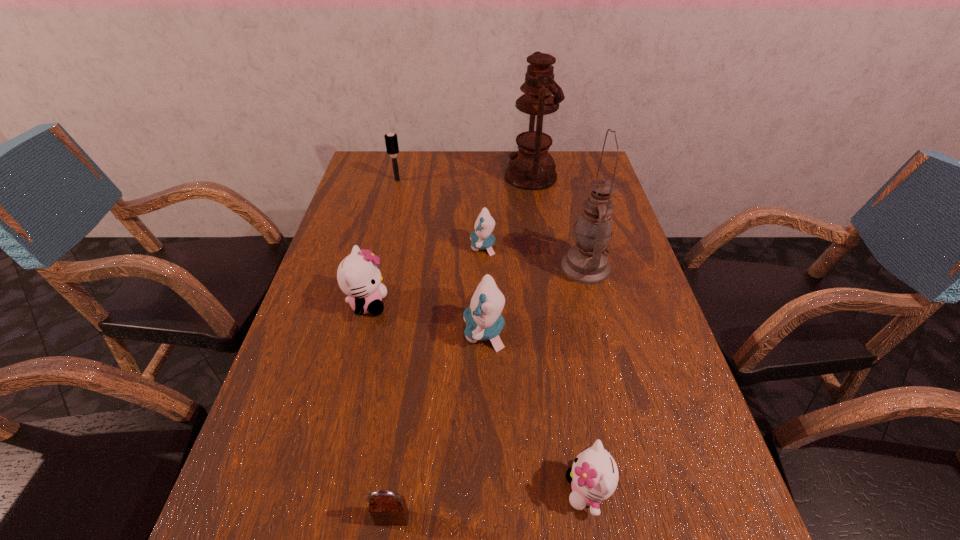
The height and width of the screenshot is (540, 960). Find the location of `blank region between the padlock and the farther oil lamp`. blank region between the padlock and the farther oil lamp is located at coordinates (462, 347).

This screenshot has width=960, height=540. Identify the location of free space between the farther oil lamp and the brown padlock. (462, 347).

Locate an element on the screen. This screenshot has width=960, height=540. vacant area between the hairbrush and the leftmost kitten is located at coordinates (382, 242).

You are a GUI agent. You are given a task and a screenshot of the screen. Output one action in this format:
    pyautogui.click(x=<x>, y=<y>)
    Task: Click on the free space between the rightmost kitten and the farther oil lamp
    This screenshot has width=960, height=540.
    Given the screenshot: What is the action you would take?
    559,333

This screenshot has width=960, height=540. I want to click on free area in between the sixth object from right to left and the gray oil lamp, so click(x=489, y=393).

Identify the location of the fourth closest object to the bigger blue kitten. (594, 475).

Identify which object is the sixth nearest to the gray oil lamp. Please provide its 2D coordinates. Your answer should be formatted as a tuple, i.e. [(x, y)], where the tuple contains the x and y coordinates of a point satisfying the conditions above.

[(391, 139)]

This screenshot has height=540, width=960. I want to click on the third closest kitten to the padlock, so click(x=358, y=275).

The image size is (960, 540). In order to click on the third closest kitten relative to the nearest kitten in this screenshot , I will do `click(481, 238)`.

You are a GUI agent. You are given a task and a screenshot of the screen. Output one action in this format:
    pyautogui.click(x=<x>, y=<y>)
    Task: Click on the blank space that satisfies the following two spatial constraints: 1. on the front-facing side of the rightmost kitten; 2. on the front-facing side of the sixth object from right to left
    This screenshot has width=960, height=540.
    Given the screenshot: What is the action you would take?
    pyautogui.click(x=591, y=518)